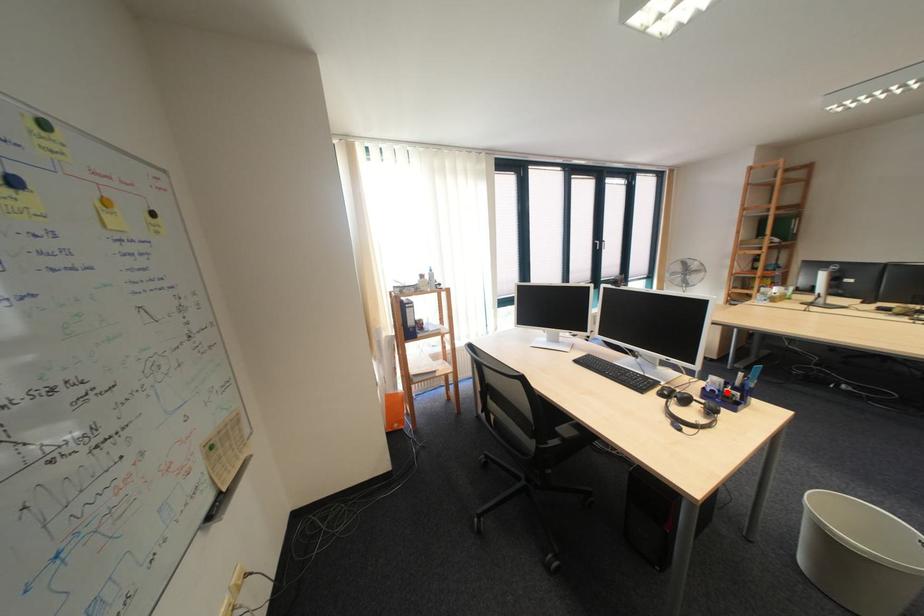
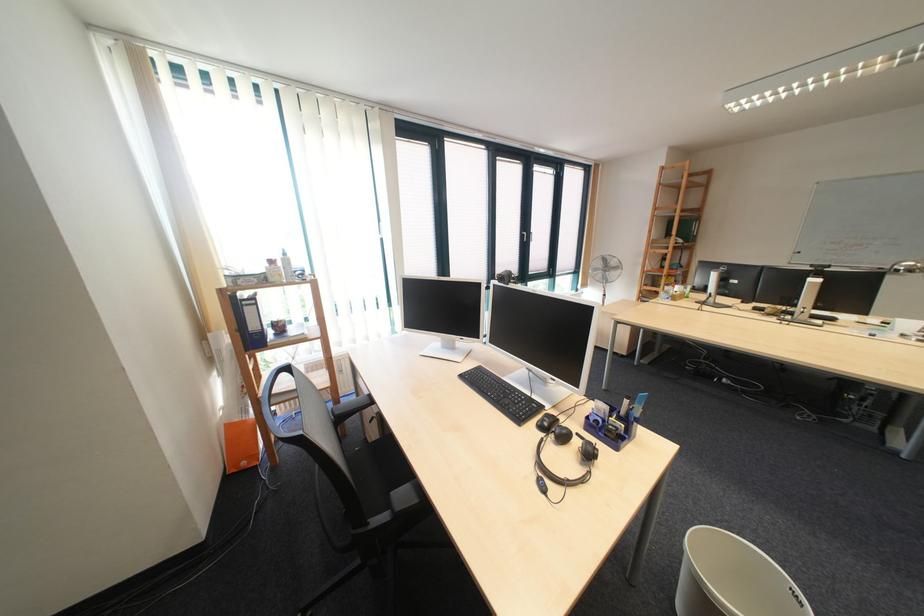
In the second image, find the point that corresponds to the highlighted location in the first image.

(611, 423)